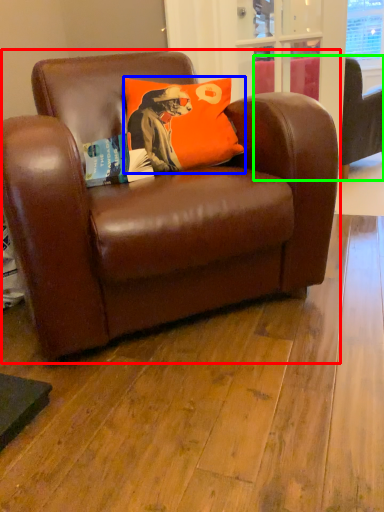
Question: Which object is the closest to the chair (highlighted by a red box)? Choose among these: pillow (highlighted by a blue box) or studio couch (highlighted by a green box).

Choices:
 (A) pillow
 (B) studio couch

Answer: (A)